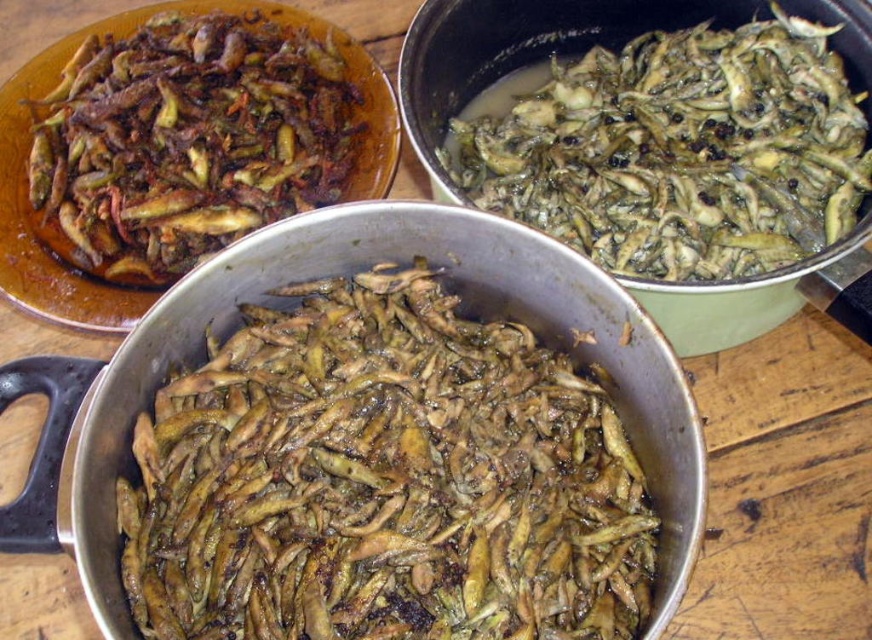
Question: Which is nearer to the brown matte fried fish at upper left?

Choices:
 (A) greenish-brown glossy fish at upper right
 (B) brown matte fish at center

Answer: (A)

Question: Which point appears farthest from the camera in this image?

Choices:
 (A) (714, 216)
 (B) (477, 618)
 (C) (337, 192)

Answer: (C)

Question: From the image, what is the correct spatial relationship of brown matte fish at center in relation to greenish-brown glossy fish at upper right?

Choices:
 (A) below
 (B) above

Answer: (A)

Question: Which of the following is the farthest from the observer?

Choices:
 (A) (634, 579)
 (B) (356, 129)
 (C) (789, 220)

Answer: (B)

Question: Where is greenish-brown glossy fish at upper right located in relation to brown matte fried fish at upper left in the image?

Choices:
 (A) left
 (B) right

Answer: (B)

Question: Is brown matte fish at center bigger than greenish-brown glossy fish at upper right?

Choices:
 (A) yes
 (B) no

Answer: (B)